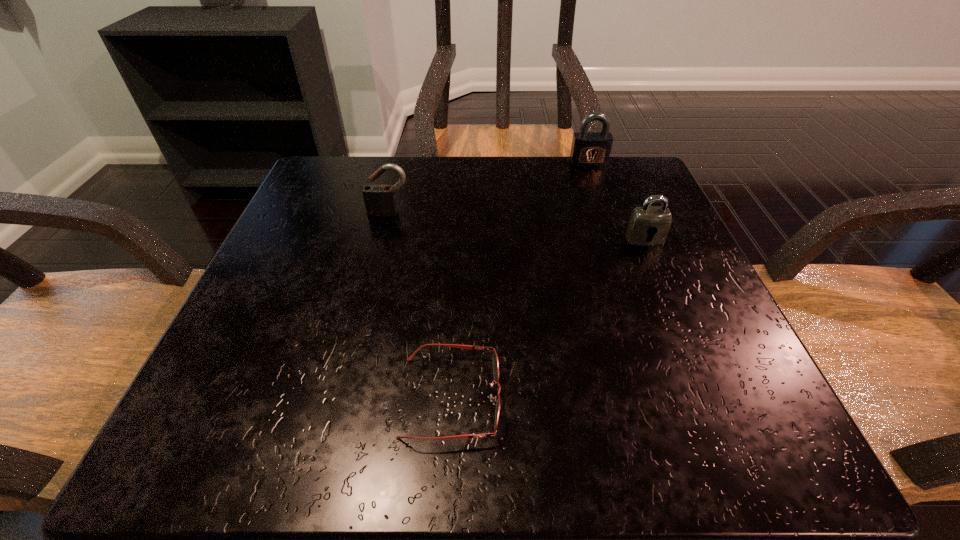
Locate an element on the screen. object that is the second nearest to the second nearest object is located at coordinates (495, 358).

What are the coordinates of `the closest object to the farthest padlock` in the screenshot? It's located at pos(648,225).

Find the location of a particular element. The height and width of the screenshot is (540, 960). padlock that stands as the closest to the second nearest padlock is located at coordinates (589, 149).

Select which padlock is the second closest to the shortest object. Please provide its 2D coordinates. Your answer should be formatted as a tuple, i.e. [(x, y)], where the tuple contains the x and y coordinates of a point satisfying the conditions above.

[(648, 225)]

I want to click on vacant space that satisfies the following two spatial constraints: 1. on the front of the farthest object near the keyhole; 2. on the lenses of the third object from right to left, so click(669, 397).

Where is `free point that satisfies the following two spatial constraints: 1. at the front of the second nearest object near the keyhole; 2. on the lenses of the nearest object`? free point that satisfies the following two spatial constraints: 1. at the front of the second nearest object near the keyhole; 2. on the lenses of the nearest object is located at coordinates (711, 397).

This screenshot has height=540, width=960. I want to click on free location that satisfies the following two spatial constraints: 1. at the front of the third farthest object near the keyhole; 2. on the lenses of the nearest object, so click(711, 397).